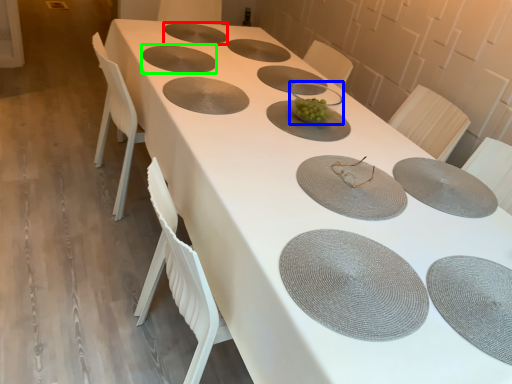
Question: Which is nearer to the tableware (highlighted by a red box)? tableware (highlighted by a blue box) or tableware (highlighted by a green box).

Choices:
 (A) tableware
 (B) tableware

Answer: (B)